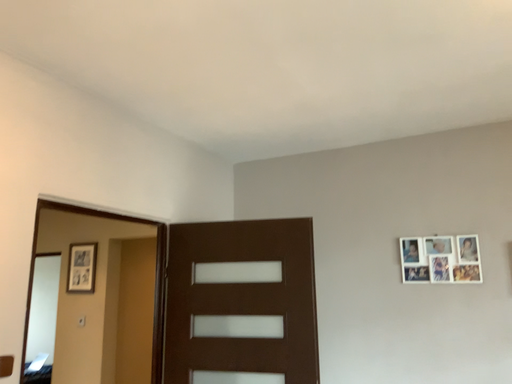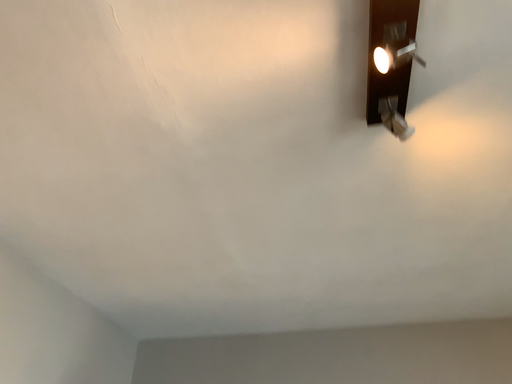
Question: Which way did the camera rotate in the video?

Choices:
 (A) rotated left
 (B) rotated right

Answer: (B)